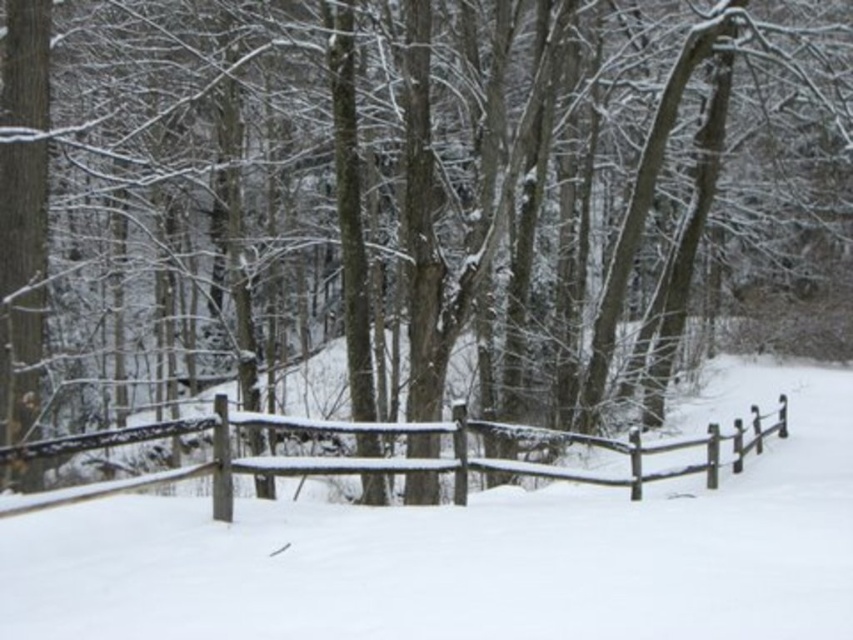
Question: Which object is closer to the camera taking this photo?

Choices:
 (A) white matte snow at center
 (B) wooden fence at center

Answer: (A)

Question: Which point is closer to the camera taking this photo?

Choices:
 (A) 25,500
 (B) 659,593

Answer: (B)

Question: Is white matte snow at center positioned behind wooden fence at center?

Choices:
 (A) no
 (B) yes

Answer: (A)

Question: Does white matte snow at center have a lesser width compared to wooden fence at center?

Choices:
 (A) no
 (B) yes

Answer: (B)

Question: Which point appears farthest from the camera in this image?

Choices:
 (A) (321, 540)
 (B) (107, 486)

Answer: (A)

Question: Observing the image, what is the correct spatial positioning of white matte snow at center in reference to wooden fence at center?

Choices:
 (A) above
 (B) below

Answer: (A)